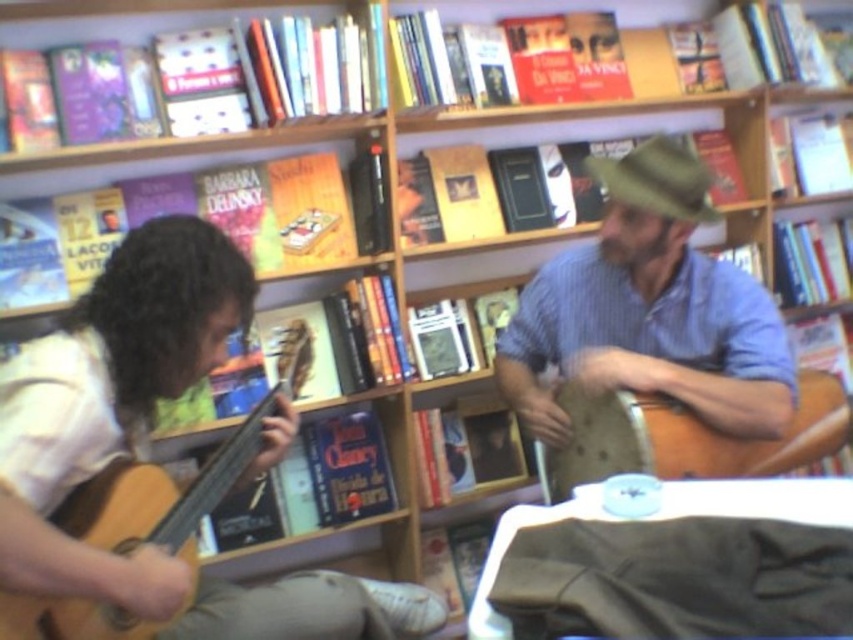
Who is positioned more to the left, blue striped shirt at center or brown wooden guitar at right?

From the viewer's perspective, blue striped shirt at center appears more on the left side.

Is point (656, 324) closer to camera compared to point (811, 442)?

No, it is behind (811, 442).

Locate an element on the screen. blue striped shirt at center is located at coordinates (648, 308).

Does blue striped shirt at center have a lesser width compared to wooden acoustic guitar at left?

No.

Does blue striped shirt at center appear on the right side of wooden acoustic guitar at left?

Correct, you'll find blue striped shirt at center to the right of wooden acoustic guitar at left.

The width and height of the screenshot is (853, 640). Describe the element at coordinates (648, 308) in the screenshot. I see `blue striped shirt at center` at that location.

The width and height of the screenshot is (853, 640). What are the coordinates of `blue striped shirt at center` in the screenshot? It's located at point(648,308).

Does brown wooden guitar at right have a lesser width compared to wooden acoustic guitar at left?

Incorrect, brown wooden guitar at right's width is not less than wooden acoustic guitar at left's.

Is point (624, 458) positioned behind point (45, 627)?

That is True.

Where is `brown wooden guitar at right`? This screenshot has width=853, height=640. brown wooden guitar at right is located at coordinates (686, 436).